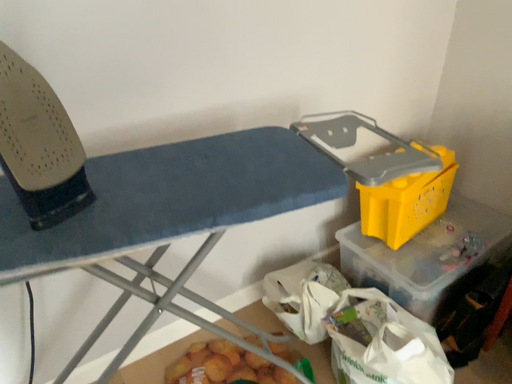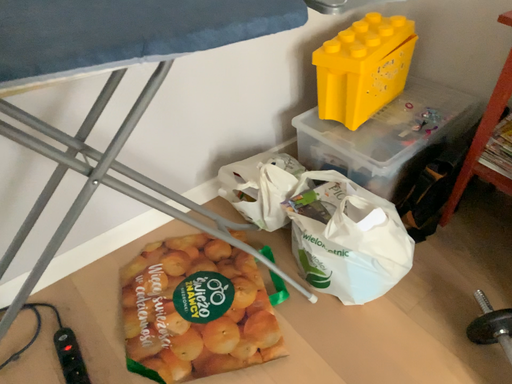
Question: How did the camera likely rotate when shooting the video?

Choices:
 (A) rotated downward
 (B) rotated upward

Answer: (A)